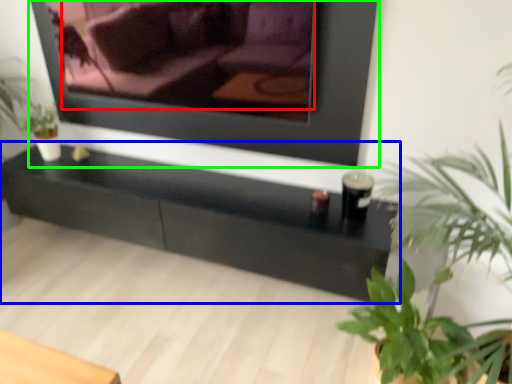
Question: Which is nearer to the couch (highlighted by a red box)? table (highlighted by a blue box) or picture frame (highlighted by a green box).

Choices:
 (A) table
 (B) picture frame

Answer: (A)